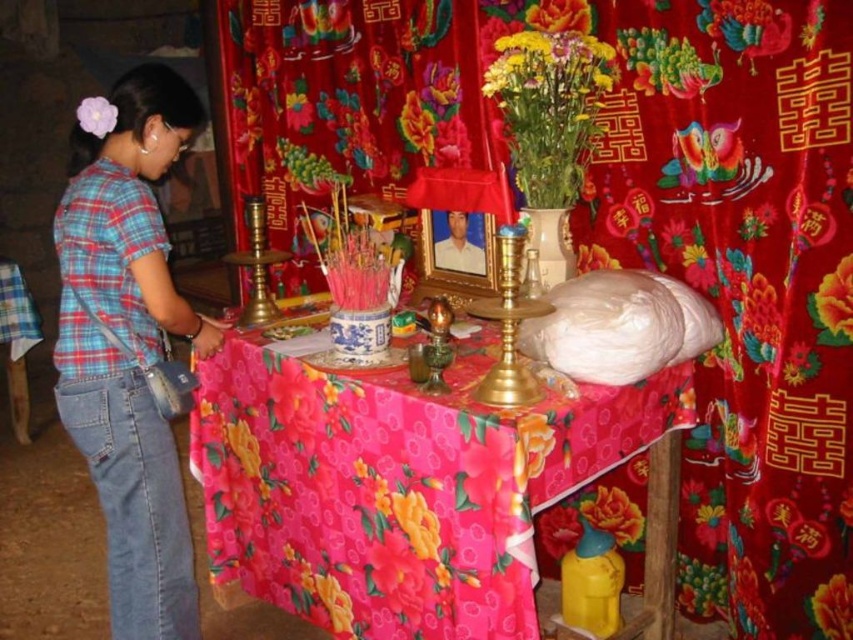
Is blue plaid shirt at left shorter than vibrant yellow bouquet at upper center?

No, blue plaid shirt at left is not shorter than vibrant yellow bouquet at upper center.

Measure the distance between blue plaid shirt at left and camera.

blue plaid shirt at left is 1.65 meters from camera.

Locate an element on the screen. This screenshot has width=853, height=640. blue plaid shirt at left is located at coordinates (131, 348).

Can you confirm if blue plaid shirt at left is smaller than floral fabric at upper center?

No, blue plaid shirt at left is not smaller than floral fabric at upper center.

Which is in front, point (126, 76) or point (850, 300)?

Point (850, 300)

Is point (99, 387) closer to camera compared to point (827, 310)?

No, it is not.

Where is `blue plaid shirt at left`? Image resolution: width=853 pixels, height=640 pixels. blue plaid shirt at left is located at coordinates (131, 348).

Can you confirm if vibrant yellow bouquet at upper center is positioned to the right of floral fabric flower at lower right?

No, vibrant yellow bouquet at upper center is not to the right of floral fabric flower at lower right.

Is vibrant yellow bouquet at upper center closer to camera compared to floral fabric flower at lower right?

Yes.

Between point (495, 86) and point (613, 534), which one is positioned behind?

The point (613, 534) is more distant.

This screenshot has width=853, height=640. I want to click on vibrant yellow bouquet at upper center, so click(x=549, y=65).